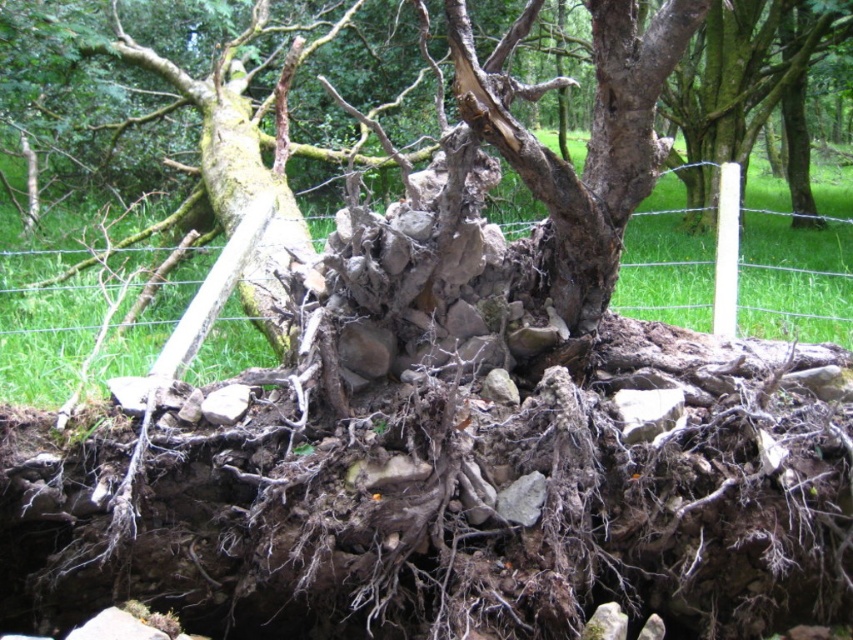
You are standing at the point marked as point (596, 92), which is 1.83 meters away from the camera. You want to take a photo of the uprooted tree with your smartphone, which has a maximum focus distance of 2 meters. Will you be able to capture the entire tree in focus without moving closer?

The point (596, 92) is 1.83 meters away from the camera. Since your smartphone has a maximum focus distance of 2 meters, you can capture the entire uprooted tree in focus without moving closer because 1.83 meters is within the 2 meters range.